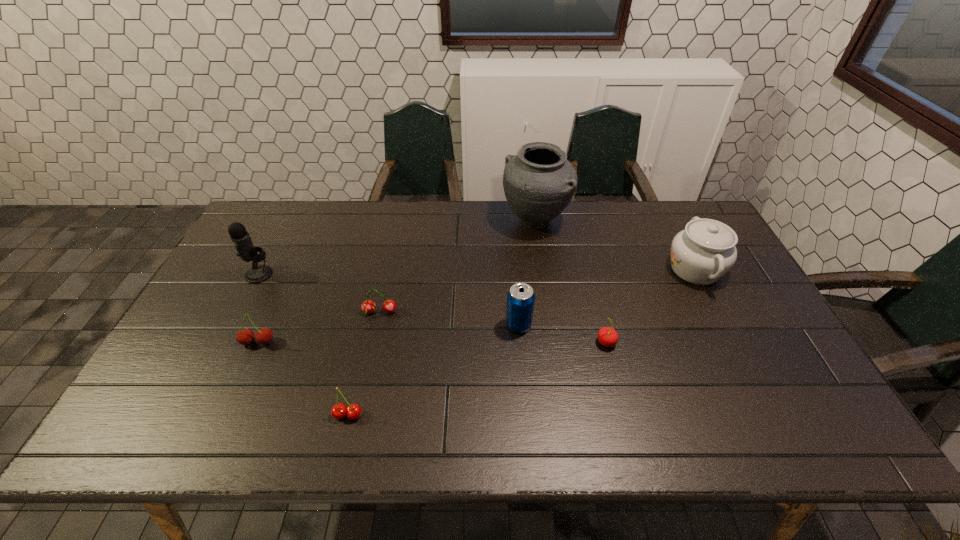
Image resolution: width=960 pixels, height=540 pixels. Identify the location of free space between the farthest cherry and the pop soda. (449, 319).

At what (x,y) coordinates should I click in order to perform the action: click on free point between the rightmost cherry and the farthest cherry. Please return your answer as a coordinate pair (x, y). The width and height of the screenshot is (960, 540). Looking at the image, I should click on (493, 327).

Locate an element on the screen. free spot between the microphone and the farthest cherry is located at coordinates (320, 293).

Identify the location of empty space between the tallest object and the rightmost object. (615, 245).

Find the location of a particular element. This screenshot has width=960, height=540. free space between the chinaware and the rightmost cherry is located at coordinates (651, 306).

Where is `unoccupied position between the sixth shortest object and the urn`? Image resolution: width=960 pixels, height=540 pixels. unoccupied position between the sixth shortest object and the urn is located at coordinates tap(615, 245).

Identify the location of the sixth closest object relative to the rightmost cherry. (245, 336).

Where is `object that is the sixth closest to the nearest object`? Image resolution: width=960 pixels, height=540 pixels. object that is the sixth closest to the nearest object is located at coordinates (539, 182).

The width and height of the screenshot is (960, 540). In order to click on cherry that stands as the third closest to the nearest cherry in this screenshot , I will do `click(607, 336)`.

Point out which cherry is positioned as the second nearest to the farthest cherry. Please provide its 2D coordinates. Your answer should be formatted as a tuple, i.e. [(x, y)], where the tuple contains the x and y coordinates of a point satisfying the conditions above.

[(339, 410)]